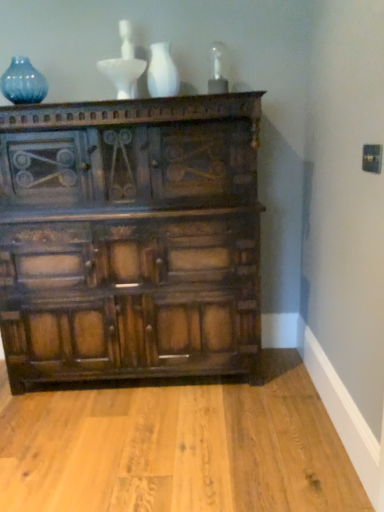
Question: Considering the relative positions of dark wood chest of drawers at center and white glossy vase at upper center in the image provided, is dark wood chest of drawers at center to the left of white glossy vase at upper center from the viewer's perspective?

Choices:
 (A) no
 (B) yes

Answer: (B)

Question: Considering the relative positions of dark wood chest of drawers at center and white glossy vase at upper center in the image provided, is dark wood chest of drawers at center to the right of white glossy vase at upper center from the viewer's perspective?

Choices:
 (A) no
 (B) yes

Answer: (A)

Question: Can you see dark wood chest of drawers at center touching white glossy vase at upper center?

Choices:
 (A) yes
 (B) no

Answer: (B)

Question: Is white glossy vase at upper center at the back of dark wood chest of drawers at center?

Choices:
 (A) no
 (B) yes

Answer: (A)

Question: Is dark wood chest of drawers at center wider than white glossy vase at upper center?

Choices:
 (A) no
 (B) yes

Answer: (B)

Question: Does dark wood chest of drawers at center have a larger size compared to white glossy vase at upper center?

Choices:
 (A) no
 (B) yes

Answer: (B)

Question: Can you confirm if blue glass vase at upper left is positioned to the left of white glossy vase at upper center?

Choices:
 (A) yes
 (B) no

Answer: (A)

Question: Can you see blue glass vase at upper left touching white glossy vase at upper center?

Choices:
 (A) no
 (B) yes

Answer: (A)

Question: Is blue glass vase at upper left far from white glossy vase at upper center?

Choices:
 (A) yes
 (B) no

Answer: (B)

Question: Is blue glass vase at upper left taller than white glossy vase at upper center?

Choices:
 (A) no
 (B) yes

Answer: (A)

Question: Can you confirm if blue glass vase at upper left is smaller than white glossy vase at upper center?

Choices:
 (A) yes
 (B) no

Answer: (B)

Question: Is blue glass vase at upper left facing towards white glossy vase at upper center?

Choices:
 (A) no
 (B) yes

Answer: (A)

Question: Can you confirm if white glossy vase at upper center is bigger than dark wood chest of drawers at center?

Choices:
 (A) yes
 (B) no

Answer: (B)